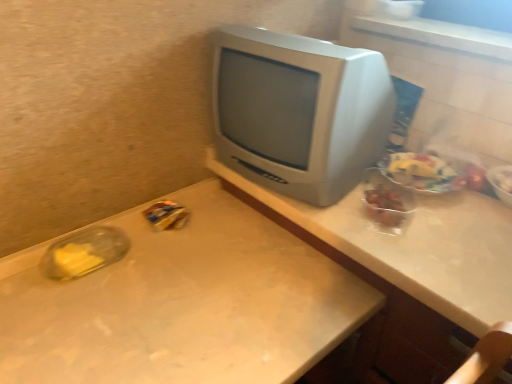
I want to click on free space in front of clear plastic container at left, so click(x=77, y=308).